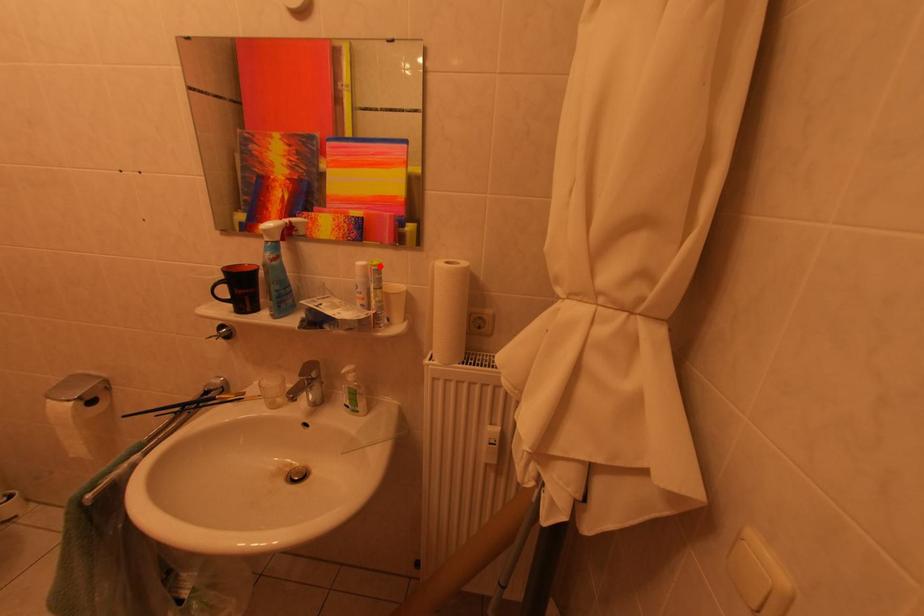
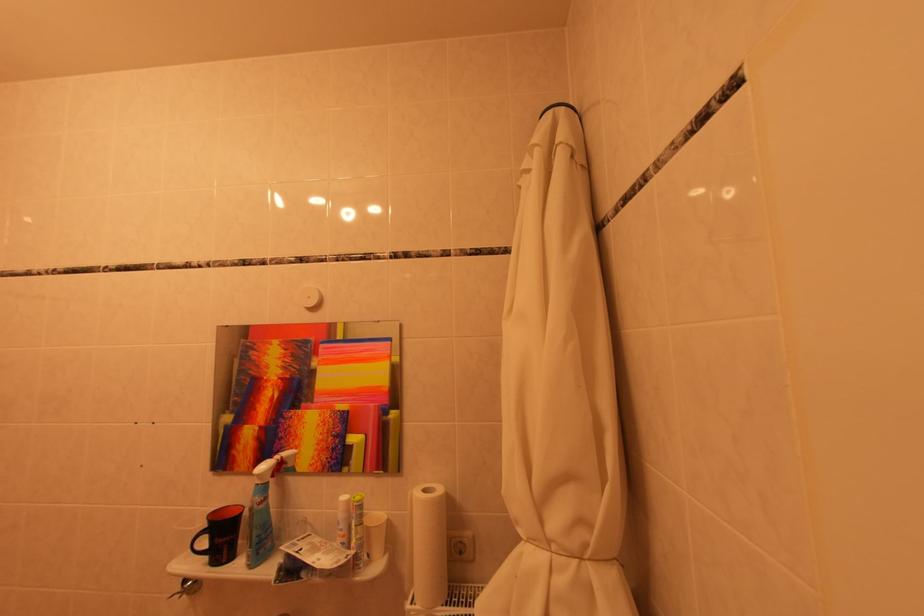
Where in the second image is the point corresponding to the highlighted location from the first image?

(362, 501)